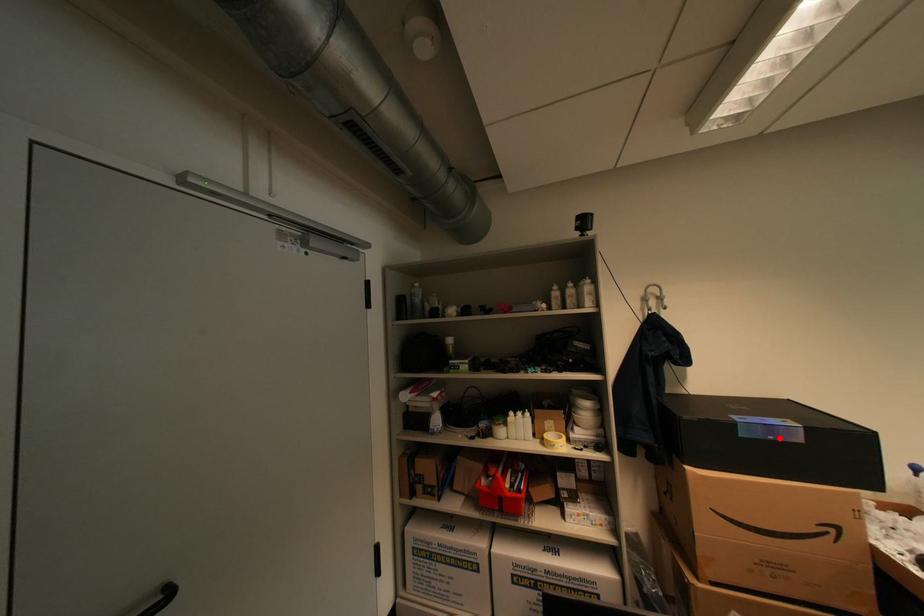
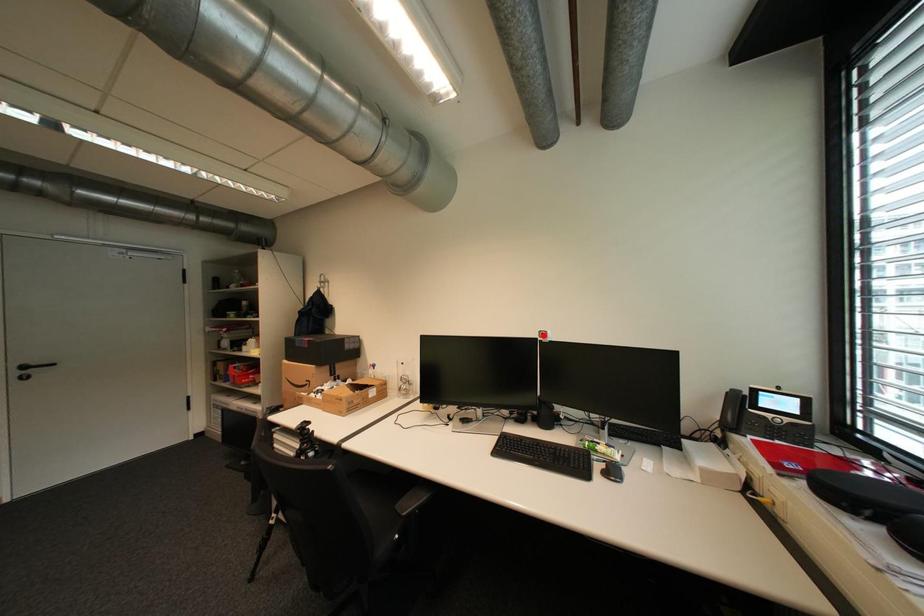
I am providing you with two images of the same scene from different viewpoints. A red point is marked on the first image and another point is marked on the second image. Does the point marked in image1 correspond to the same location as the one in image2?

No